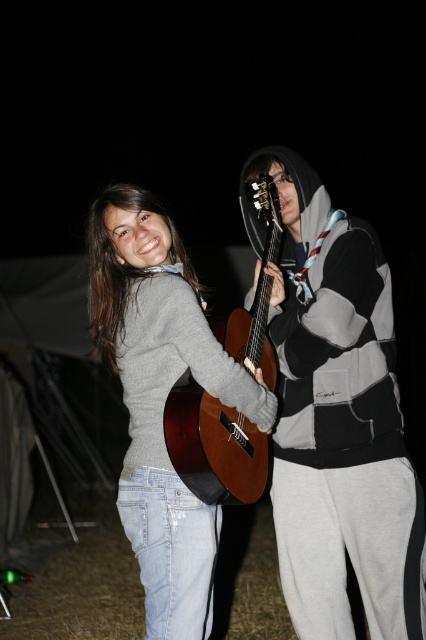
Consider the image. You are a photographer trying to capture the scene. You notice there is a point at coordinates (161, 397). What object is located at that point?

→ The point at coordinates (161, 397) is where the matte gray sweater at center is located.

You are a photographer standing in front of the scene. You want to take a photo that focuses on the wooden acoustic guitar at center without the matte gray sweater at left being too prominent. Based on their positions, can you position yourself so the guitar is in front and the sweater is partially hidden behind it?

Yes, since the wooden acoustic guitar at center is closer to the viewer than the matte gray sweater at left, positioning yourself so the guitar is in front would naturally hide the sweater partially behind it.

From the picture: You are a photographer setting up a shoot in this scene. You need to place a spotlight on the object that is higher up. Which object should you choose between the matte black hoodie at center and the matte gray sweater at center?

The matte black hoodie at center is located above the matte gray sweater at center, so you should place the spotlight on the matte black hoodie at center.